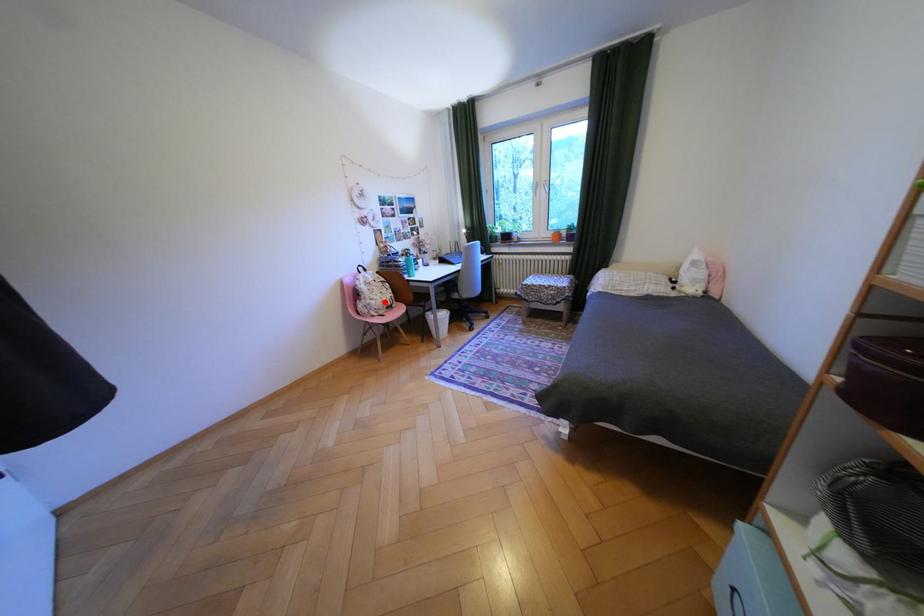
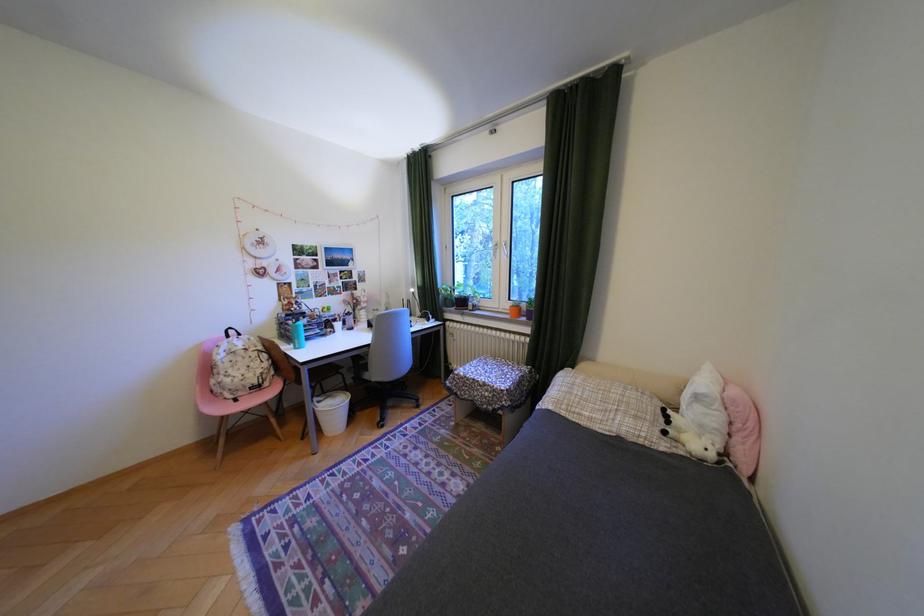
Question: A red point is marked in image1. In image2, is the corresponding 3D point closer to the camera or farther? Reply with the corresponding letter.

Choices:
 (A) The corresponding 3D point is closer.
 (B) The corresponding 3D point is farther.

Answer: (B)